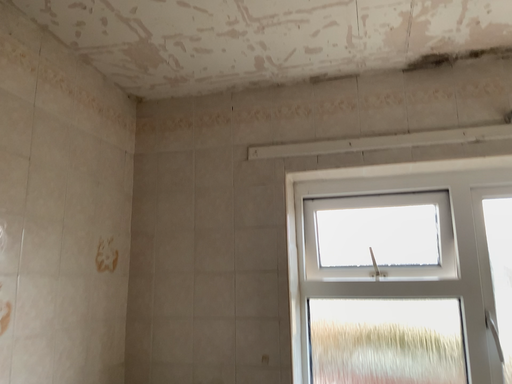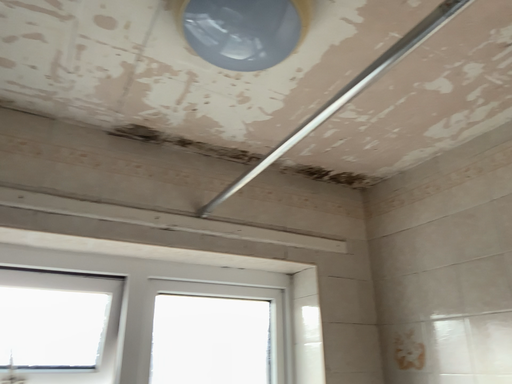
Question: How did the camera likely rotate when shooting the video?

Choices:
 (A) rotated upward
 (B) rotated downward

Answer: (A)